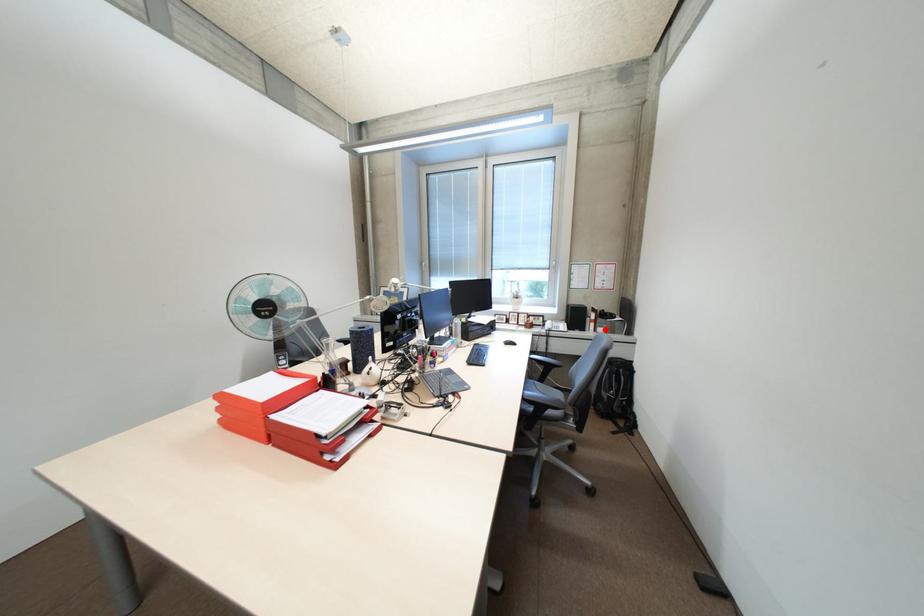
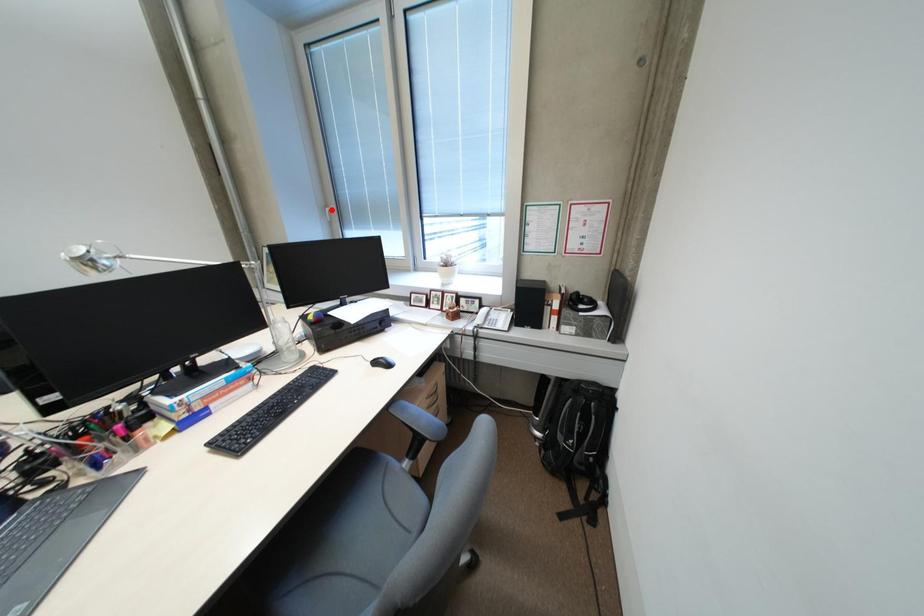
I am providing you with two images of the same scene from different viewpoints. A red point is marked on the first image and another point is marked on the second image. Does the point marked in image1 correspond to the same location as the one in image2?

No